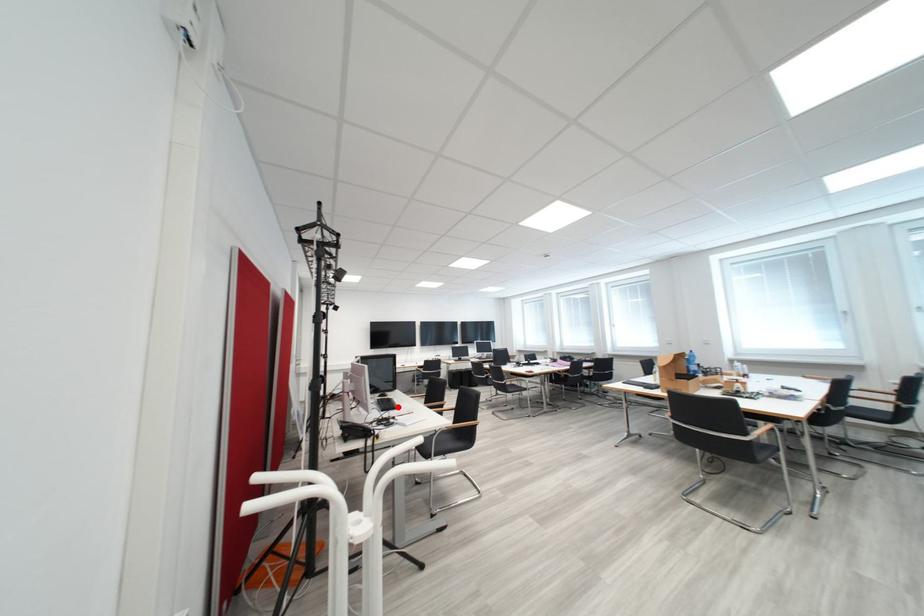
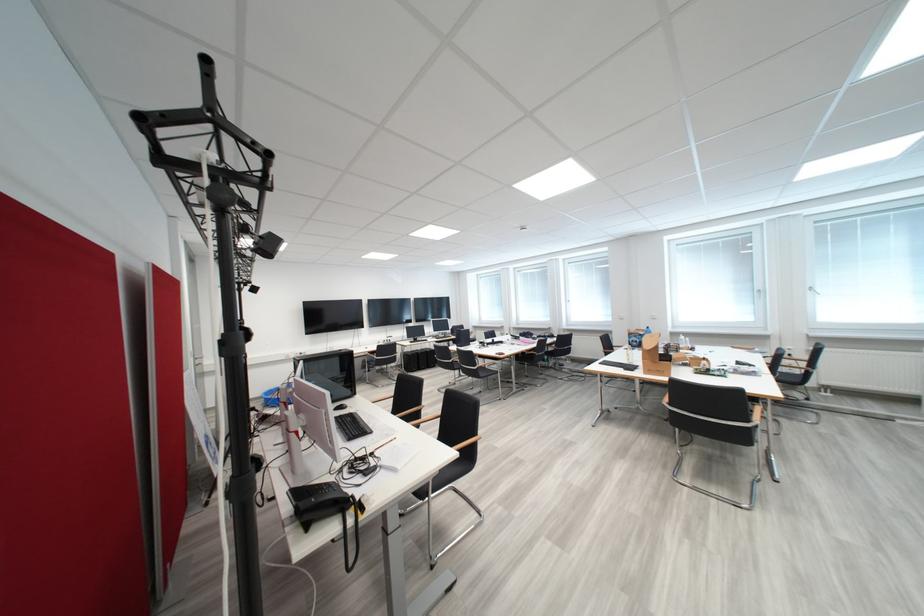
Question: I am providing you with two images of the same scene from different viewpoints. Image1 has a red point marked. In image2, the corresponding 3D location appears at what relative position? Reply with the corresponding letter.

Choices:
 (A) Closer
 (B) Farther

Answer: (B)